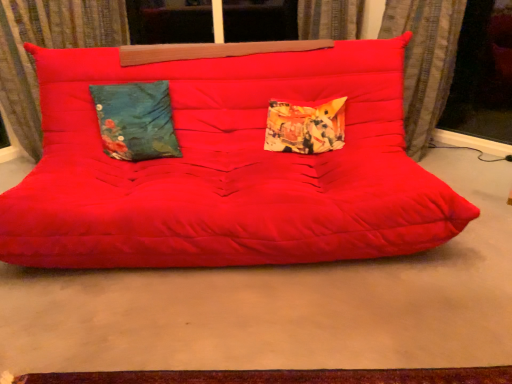
Question: From a real-world perspective, is velvet curtain at upper left, the 1th curtain when ordered from left to right, physically below matte red studio couch at center?

Choices:
 (A) yes
 (B) no

Answer: (B)

Question: Is velvet curtain at upper left, placed as the 2th curtain when sorted from right to left, behind matte red studio couch at center?

Choices:
 (A) yes
 (B) no

Answer: (A)

Question: Can you confirm if velvet curtain at upper left, placed as the 2th curtain when sorted from right to left, is shorter than matte red studio couch at center?

Choices:
 (A) no
 (B) yes

Answer: (A)

Question: Is the surface of velvet curtain at upper left, the 1th curtain when ordered from left to right, in direct contact with matte red studio couch at center?

Choices:
 (A) yes
 (B) no

Answer: (B)

Question: Is velvet curtain at upper left, the 1th curtain when ordered from left to right, completely or partially outside of matte red studio couch at center?

Choices:
 (A) yes
 (B) no

Answer: (A)

Question: Is velvet curtain at upper left, the 1th curtain when ordered from left to right, to the right of matte red studio couch at center from the viewer's perspective?

Choices:
 (A) no
 (B) yes

Answer: (A)

Question: From the image's perspective, is velvet curtain at upper left, the 1th curtain when ordered from left to right, located beneath teal floral fabric pillow at left, acting as the second pillow starting from the right?

Choices:
 (A) no
 (B) yes

Answer: (A)

Question: Does velvet curtain at upper left, placed as the 2th curtain when sorted from right to left, have a lesser height compared to teal floral fabric pillow at left, the first pillow when ordered from left to right?

Choices:
 (A) no
 (B) yes

Answer: (A)

Question: From a real-world perspective, is velvet curtain at upper left, the 1th curtain when ordered from left to right, under teal floral fabric pillow at left, acting as the second pillow starting from the right?

Choices:
 (A) yes
 (B) no

Answer: (B)

Question: Could you tell me if velvet curtain at upper left, the 1th curtain when ordered from left to right, is facing teal floral fabric pillow at left, acting as the second pillow starting from the right?

Choices:
 (A) yes
 (B) no

Answer: (A)

Question: Are velvet curtain at upper left, placed as the 2th curtain when sorted from right to left, and teal floral fabric pillow at left, acting as the second pillow starting from the right, far apart?

Choices:
 (A) yes
 (B) no

Answer: (B)

Question: Considering the relative positions of velvet curtain at upper left, placed as the 2th curtain when sorted from right to left, and teal floral fabric pillow at left, the first pillow when ordered from left to right, in the image provided, is velvet curtain at upper left, placed as the 2th curtain when sorted from right to left, to the right of teal floral fabric pillow at left, the first pillow when ordered from left to right, from the viewer's perspective?

Choices:
 (A) yes
 (B) no

Answer: (B)

Question: From a real-world perspective, is printed fabric pillow at center, which appears as the 1th pillow when viewed from the right, under transparent glass window screen at right?

Choices:
 (A) yes
 (B) no

Answer: (A)